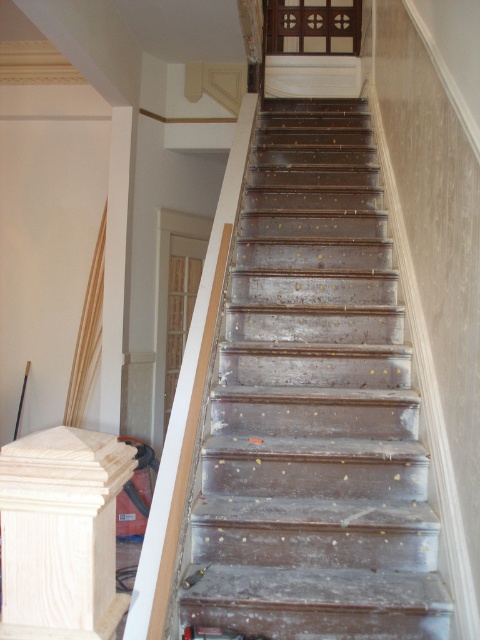
You are standing at the bottom of the staircase and want to reach the top. There are two points marked on the wall. One is at point (394, 470) and the other is at point (72, 596). Which point is closer to the top of the staircase?

Point (394, 470) is behind point (72, 596), so it is closer to the top of the staircase.

You are a construction worker carrying a 1.2 meter long plank of wood. You need to move it from the wooden stairs at center to the unfinished wood post at left. Is there enough space to carry the plank horizontally without tilting it?

The wooden stairs at center and unfinished wood post at left are 1.19 meters apart. Since the plank is 1.2 meters long, which is slightly longer than the distance between them, you cannot carry the plank horizontally without tilting it.